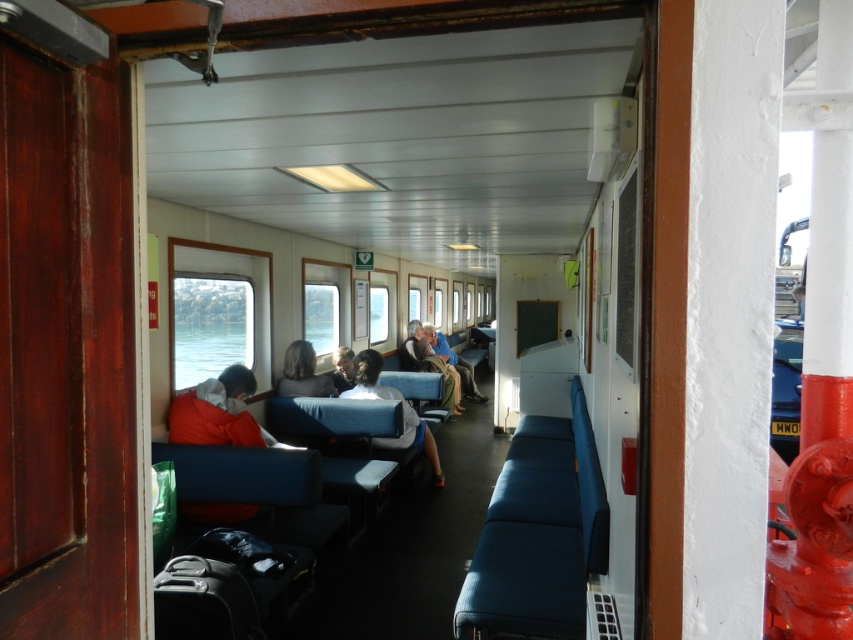
Question: Which object appears farthest from the camera in this image?

Choices:
 (A) light blue fabric seat at center
 (B) blue fabric jacket at center
 (C) light brown leather jacket at center

Answer: (B)

Question: Is gray fabric jacket at center below smooth gray shirt at center?

Choices:
 (A) no
 (B) yes

Answer: (B)

Question: Which object is positioned farthest from the light blue fabric seat at center?

Choices:
 (A) gray fabric jacket at center
 (B) smooth gray shirt at center
 (C) light brown leather jacket at center
 (D) blue fabric jacket at center

Answer: (D)

Question: Is gray fabric jacket at center to the right of smooth gray shirt at center from the viewer's perspective?

Choices:
 (A) no
 (B) yes

Answer: (A)

Question: Estimate the real-world distances between objects in this image. Which object is farther from the smooth gray shirt at center?

Choices:
 (A) gray fabric jacket at center
 (B) light brown leather jacket at center
 (C) blue fabric jacket at center

Answer: (C)

Question: Where is gray fabric jacket at center located in relation to light brown leather jacket at center in the image?

Choices:
 (A) below
 (B) above

Answer: (B)